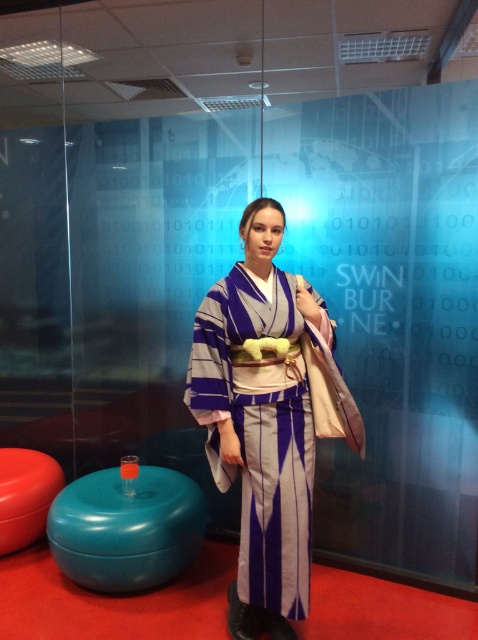
Question: Estimate the real-world distances between objects in this image. Which object is closer to the matte red stool at lower left?

Choices:
 (A) silky purple kimono at center
 (B) teal glossy stool at lower left

Answer: (B)

Question: Does teal glossy stool at lower left come behind matte red stool at lower left?

Choices:
 (A) no
 (B) yes

Answer: (A)

Question: Does silky purple kimono at center appear on the right side of teal glossy stool at lower left?

Choices:
 (A) yes
 (B) no

Answer: (A)

Question: Which object appears closest to the camera in this image?

Choices:
 (A) matte red stool at lower left
 (B) teal glossy stool at lower left

Answer: (B)

Question: Can you confirm if silky purple kimono at center is smaller than matte red stool at lower left?

Choices:
 (A) no
 (B) yes

Answer: (A)

Question: Which object is farther from the camera taking this photo?

Choices:
 (A) teal glossy stool at lower left
 (B) matte red stool at lower left
 (C) silky purple kimono at center

Answer: (B)